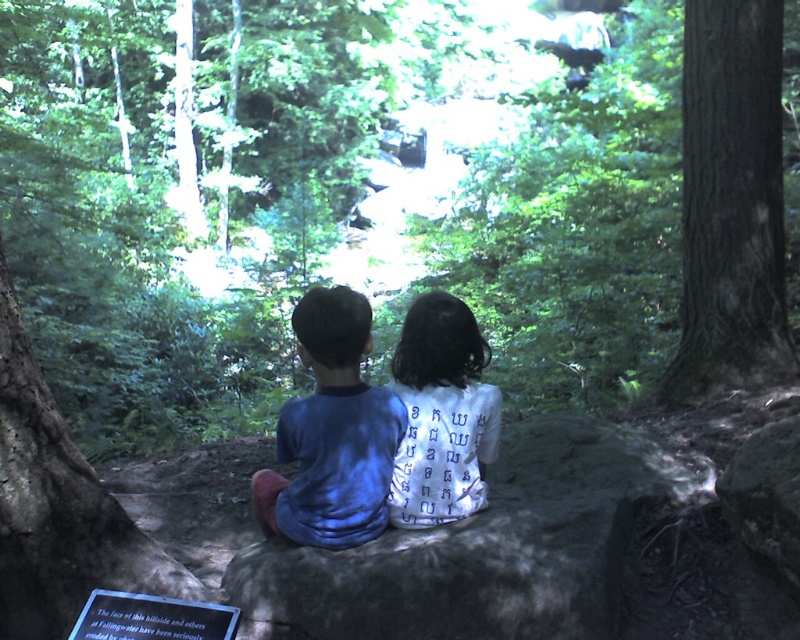
Question: Is blue cotton shirt at center wider than white fabric shirt at center?

Choices:
 (A) no
 (B) yes

Answer: (B)

Question: Estimate the real-world distances between objects in this image. Which object is farther from the blue cotton shirt at center?

Choices:
 (A) white fabric shirt at center
 (B) gray textured rock at center
 (C) smooth brown bark at right

Answer: (C)

Question: Which point is closer to the camera?

Choices:
 (A) (401, 504)
 (B) (260, 593)
 (C) (352, 364)
 (D) (716, 125)

Answer: (B)

Question: Does gray textured rock at center have a smaller size compared to white fabric shirt at center?

Choices:
 (A) yes
 (B) no

Answer: (B)

Question: Among these points, which one is farthest from the camera?

Choices:
 (A) (292, 529)
 (B) (764, 129)

Answer: (B)

Question: Is gray textured rock at center to the left of smooth brown bark at right from the viewer's perspective?

Choices:
 (A) yes
 (B) no

Answer: (A)